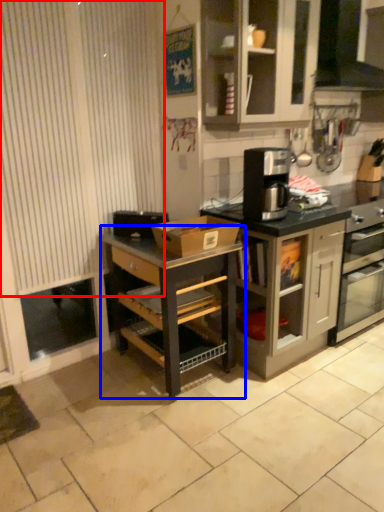
Question: Which object appears farthest to the camera in this image, curtain (highlighted by a red box) or shelf (highlighted by a blue box)?

Choices:
 (A) curtain
 (B) shelf

Answer: (B)